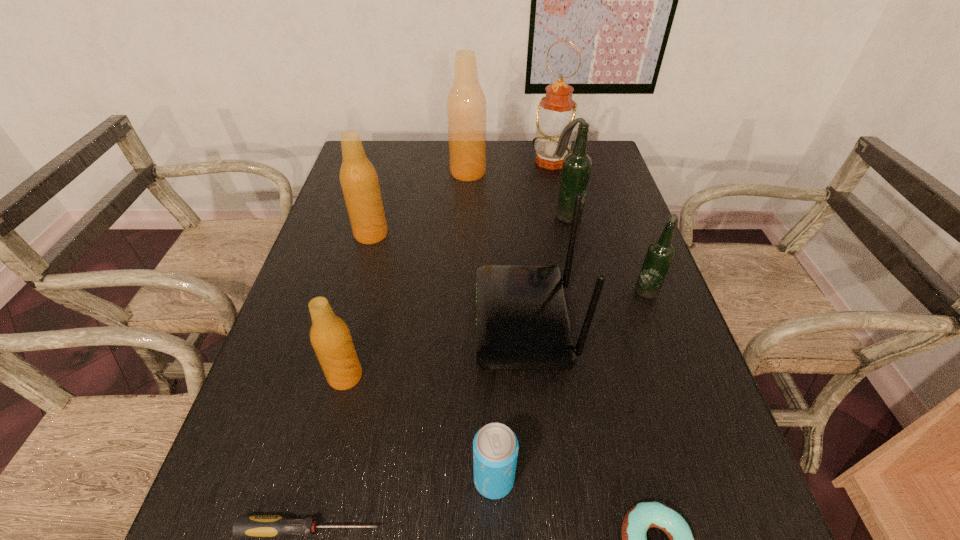
Locate an element on the screen. oil lamp is located at coordinates (557, 109).

Find the location of `the tallest beer bottle`. the tallest beer bottle is located at coordinates (466, 105).

In order to click on the farthest tan beer bottle in this screenshot , I will do `click(466, 105)`.

The width and height of the screenshot is (960, 540). I want to click on the bigger dark beer bottle, so click(577, 165).

I want to click on the farther dark beer bottle, so click(577, 165).

The width and height of the screenshot is (960, 540). What are the coordinates of `the second smallest tan beer bottle` in the screenshot? It's located at (359, 181).

The image size is (960, 540). I want to click on router, so click(522, 323).

Locate an element on the screen. the rightmost beer bottle is located at coordinates (660, 253).

Where is `the nearer dark beer bottle`? the nearer dark beer bottle is located at coordinates (660, 253).

Where is `the nearest tan beer bottle`? The width and height of the screenshot is (960, 540). the nearest tan beer bottle is located at coordinates (330, 337).